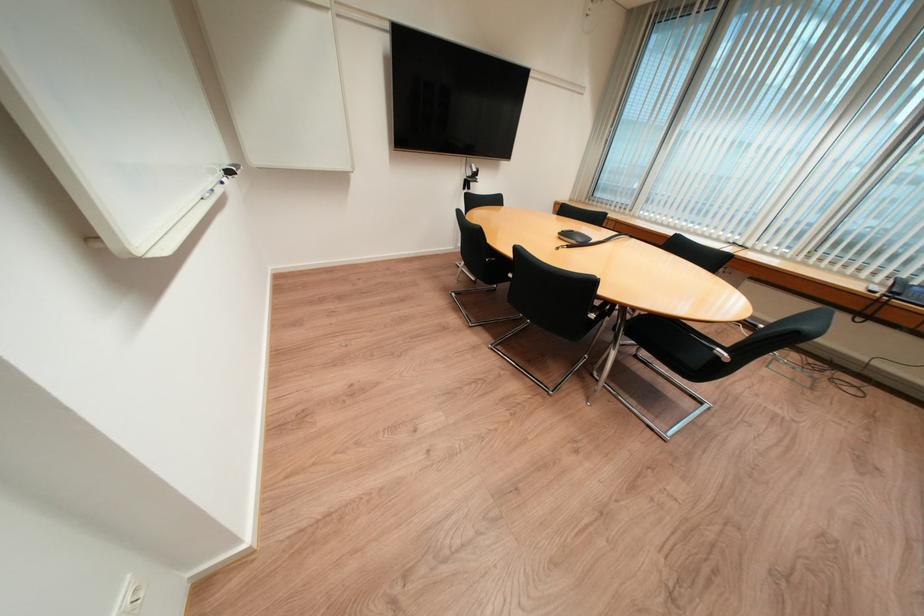
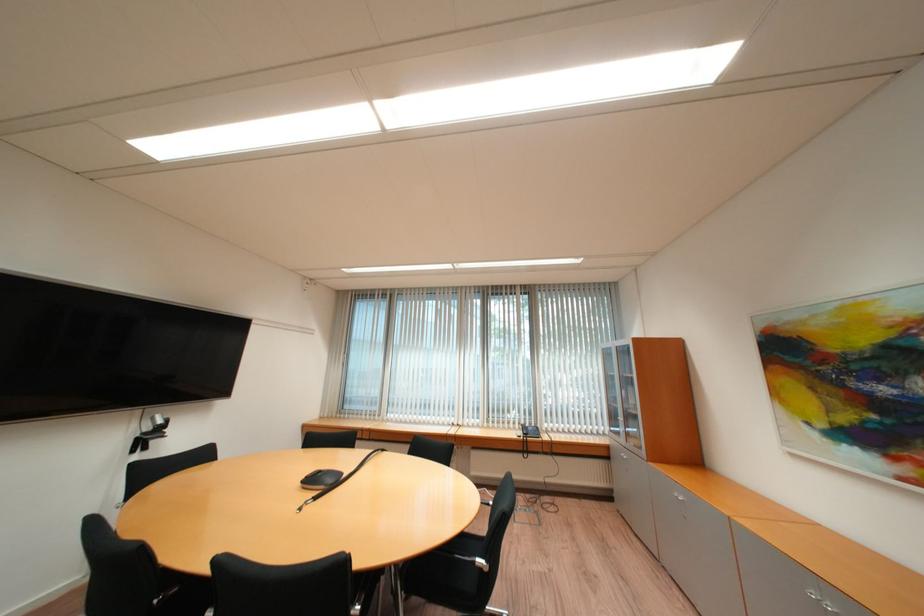
Locate, in the second image, the point that corresponds to the point at 726,351 in the first image.

(487, 561)